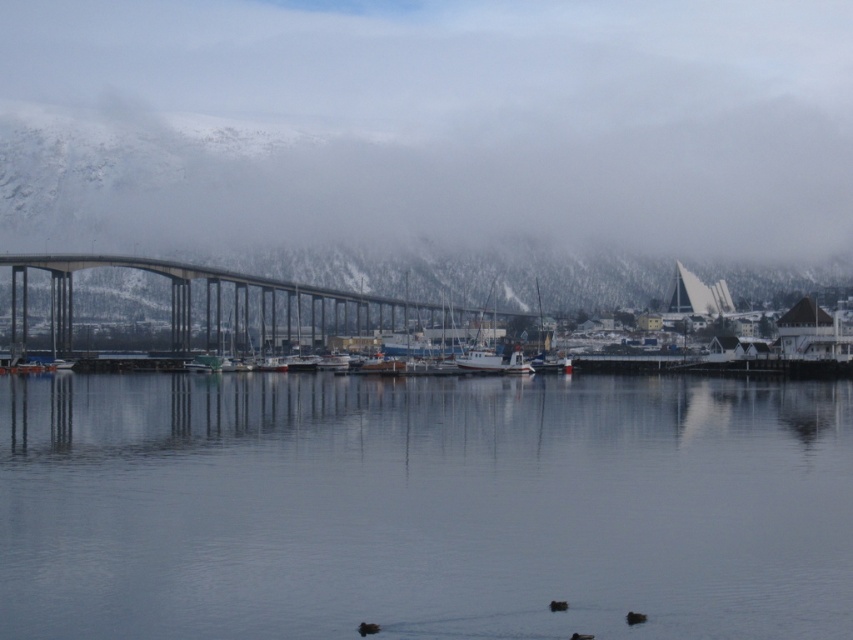
Based on the photo, is transparent water at center to the right of concrete bridge at center from the viewer's perspective?

Indeed, transparent water at center is positioned on the right side of concrete bridge at center.

Find the location of a particular element. The height and width of the screenshot is (640, 853). transparent water at center is located at coordinates (422, 506).

This screenshot has height=640, width=853. I want to click on transparent water at center, so click(x=422, y=506).